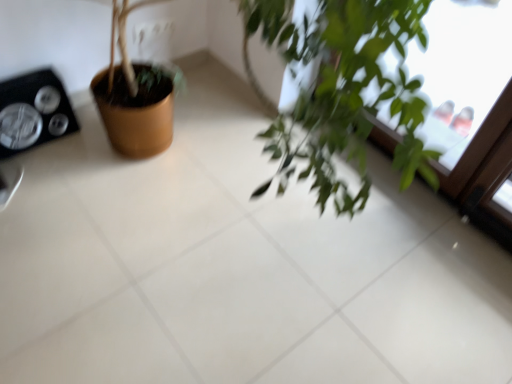
Identify the location of vacant space in front of metallic silver speaker at upper left. The width and height of the screenshot is (512, 384). (36, 175).